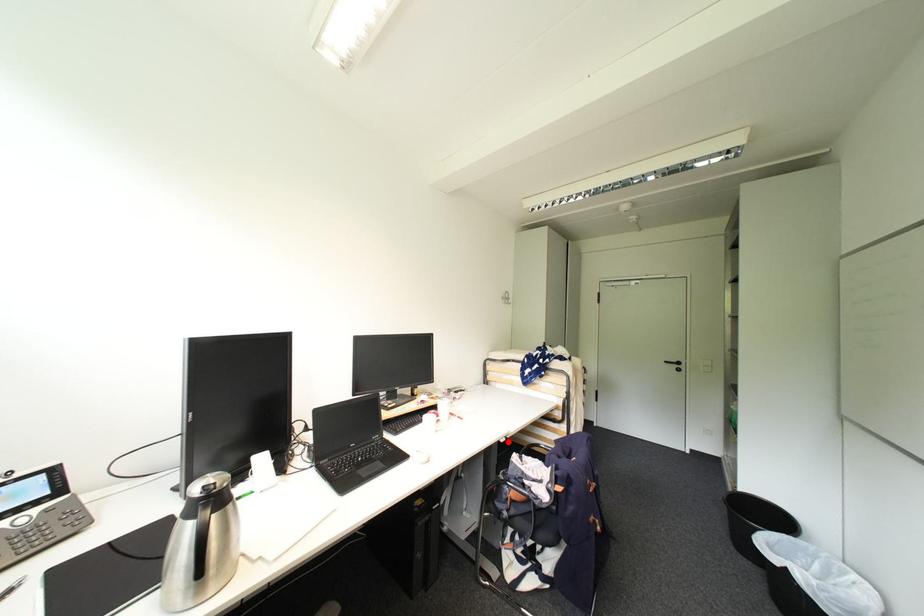
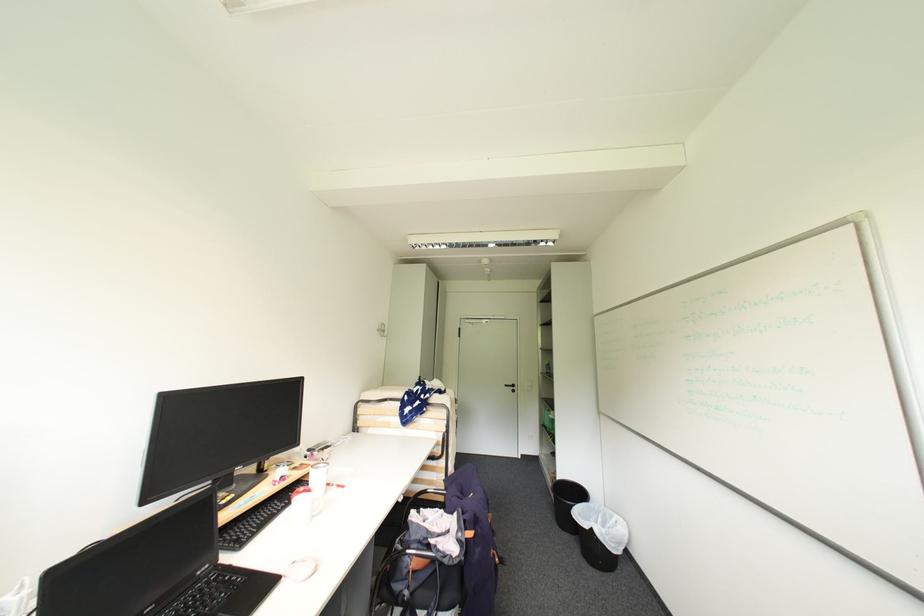
The point at the highlighted location is marked in the first image. Where is the corresponding point in the second image?

(407, 501)